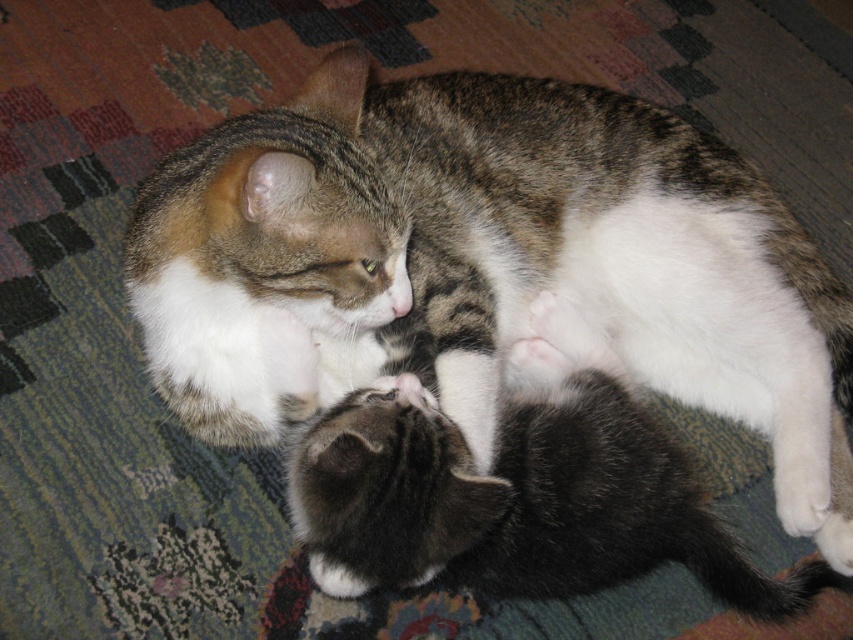
In the scene where two cats are on a patterned carpet, there is a point marked at coordinates [486,262]. Which cat does this point correspond to?

The point at [486,262] corresponds to the tabby fur cat at center.

You are observing two points in the image of the cats. Which point is closer to you, point (738,330) or point (579,396)?

Point (738,330) is closer to you than point (579,396).